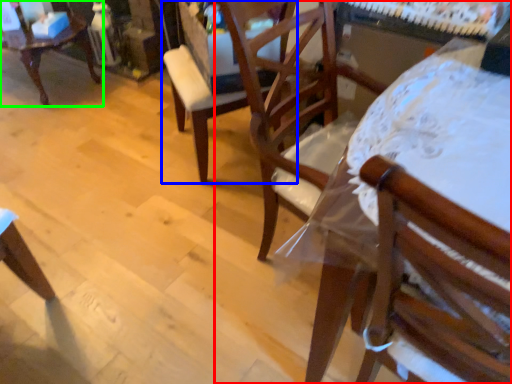
Question: Which is farther away from chair (highlighted by a red box)? chair (highlighted by a blue box) or chair (highlighted by a green box)?

Choices:
 (A) chair
 (B) chair

Answer: (B)